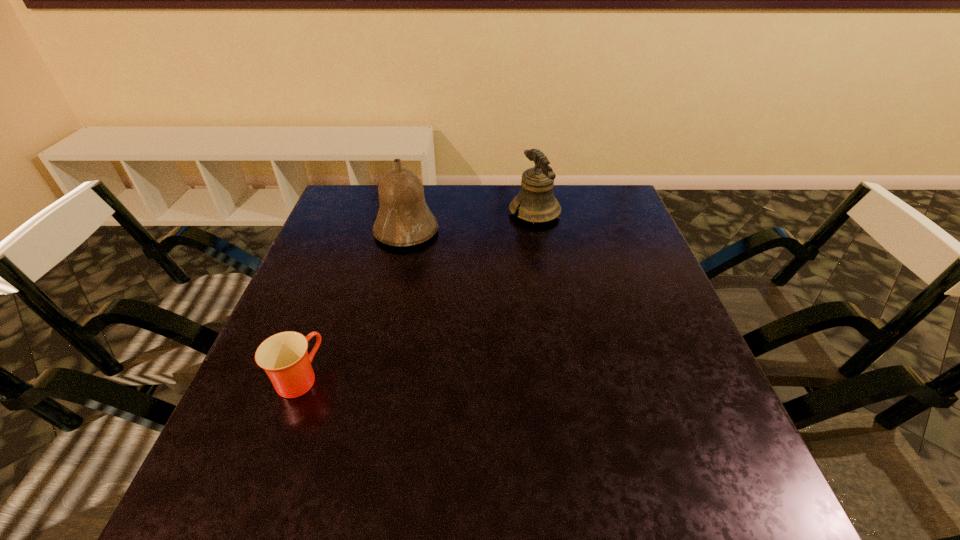
Locate an element on the screen. the second object from left to right is located at coordinates (404, 219).

Find the location of a particular element. the right bell is located at coordinates (536, 202).

The height and width of the screenshot is (540, 960). Find the location of `the shortest object`. the shortest object is located at coordinates (284, 357).

Image resolution: width=960 pixels, height=540 pixels. In order to click on the leftmost object in this screenshot , I will do `click(284, 357)`.

Find the location of a particular element. The image size is (960, 540). free point located 0.270m on the right of the second object from left to right is located at coordinates (535, 231).

I want to click on vacant space located on the left of the rightmost object, so click(x=442, y=213).

Identify the location of vacant region located 0.100m on the right of the nearest object. (372, 378).

Image resolution: width=960 pixels, height=540 pixels. I want to click on bell that is at the left edge, so click(404, 219).

At what (x,y) coordinates should I click in order to perform the action: click on cup present at the left edge. Please return your answer as a coordinate pair (x, y). The height and width of the screenshot is (540, 960). Looking at the image, I should click on point(284,357).

Where is `object at the far left corner`? object at the far left corner is located at coordinates (404, 219).